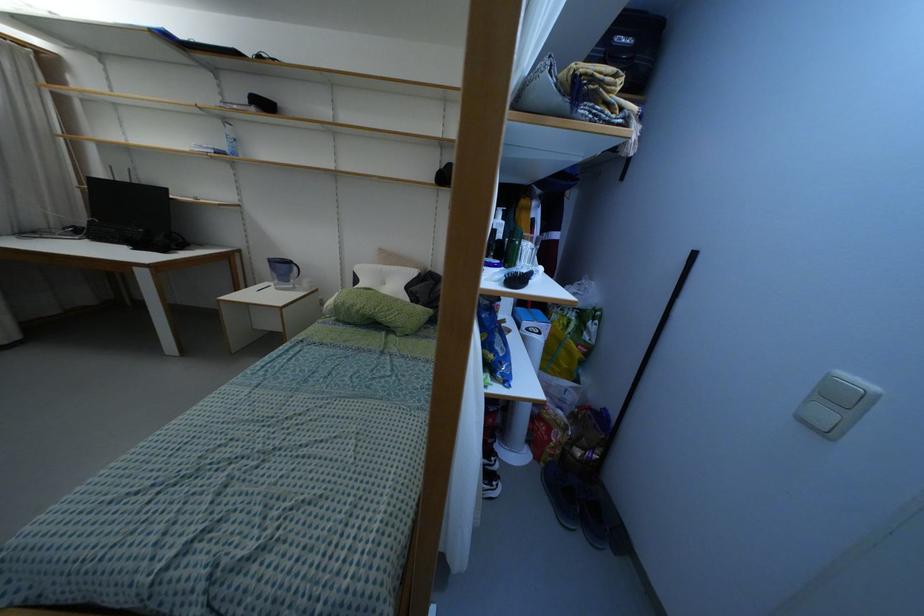
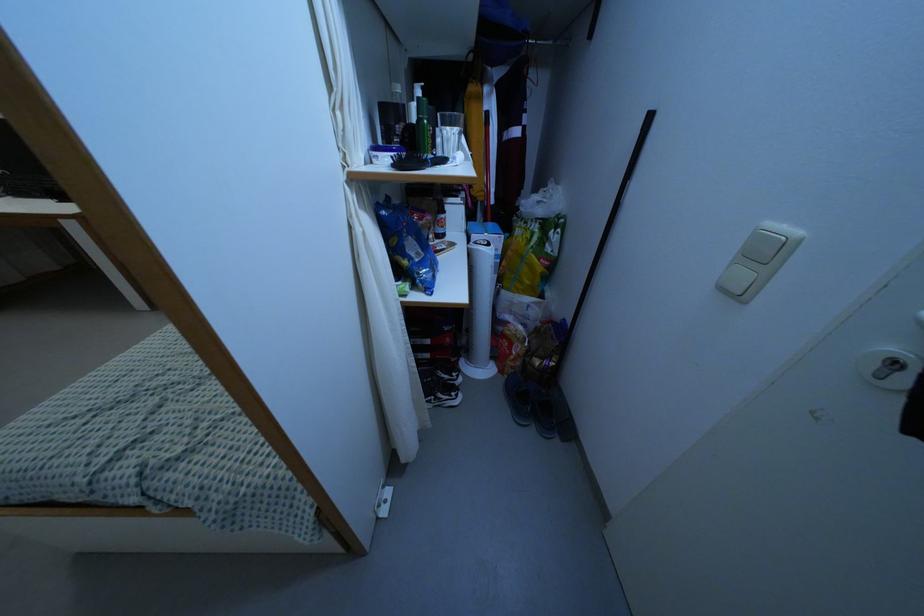
Locate, in the second image, the point that corresponds to point (824, 414) in the first image.

(743, 276)